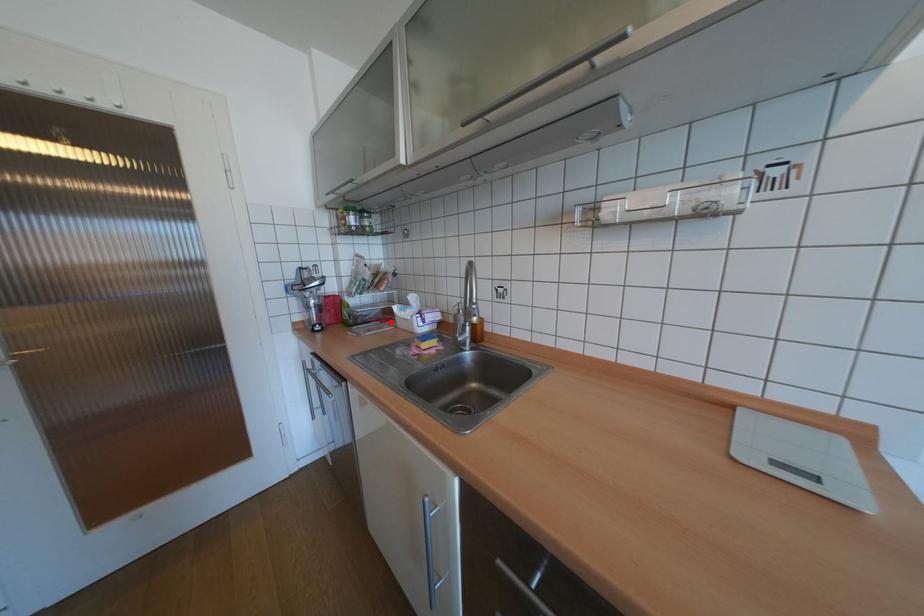
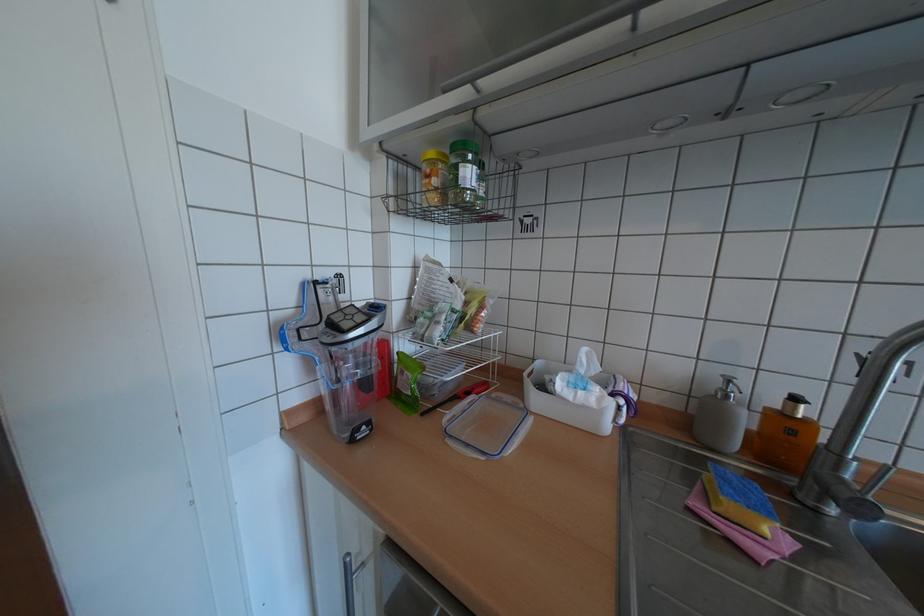
Find the pixel in the second image that matches the highlighted location in the first image.

(487, 394)